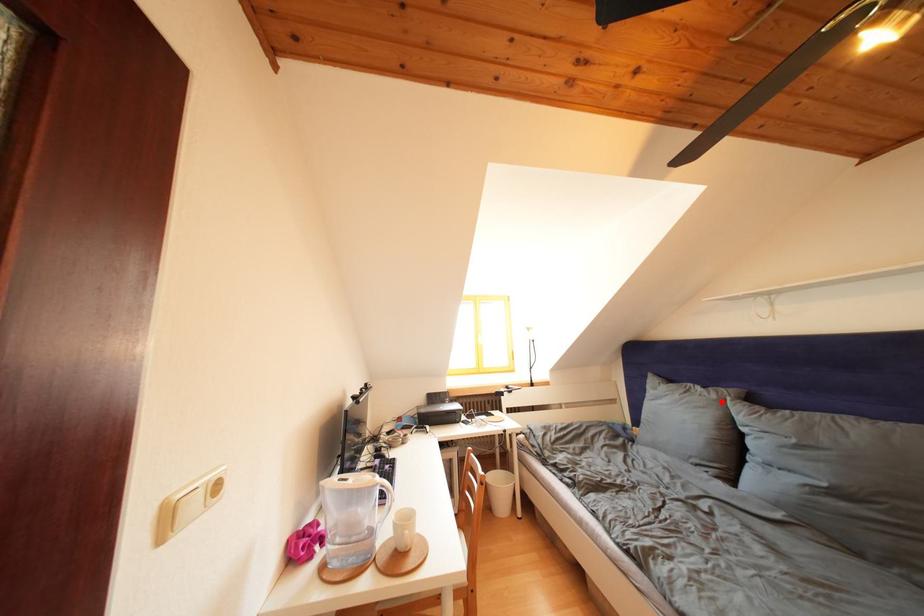
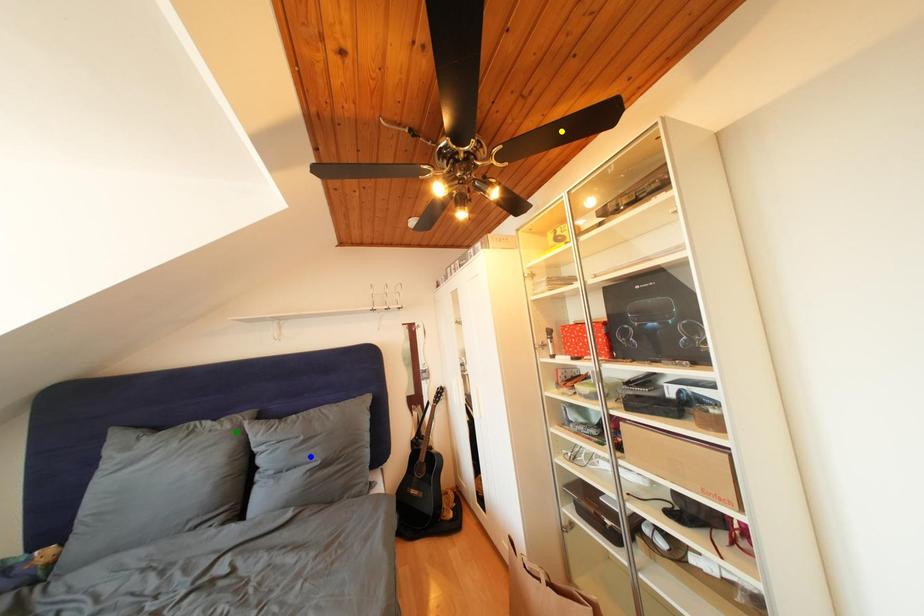
Question: I am providing you with two images of the same scene from different viewpoints. A red point is marked on the first image. You are given multiple points on the second image. Which point in image 2 is actually the same real-world point as the red point in image 1?

Choices:
 (A) yellow point
 (B) green point
 (C) blue point

Answer: (B)